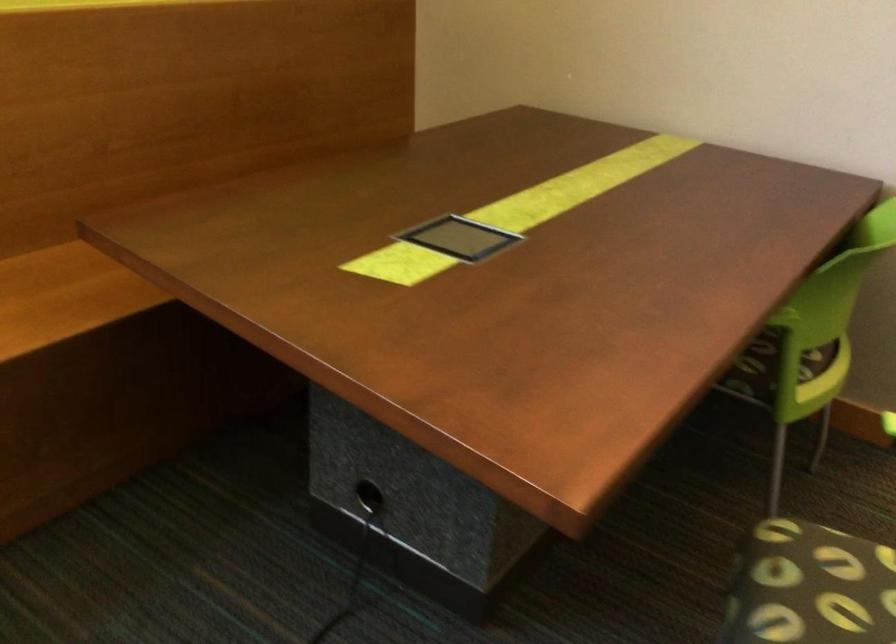
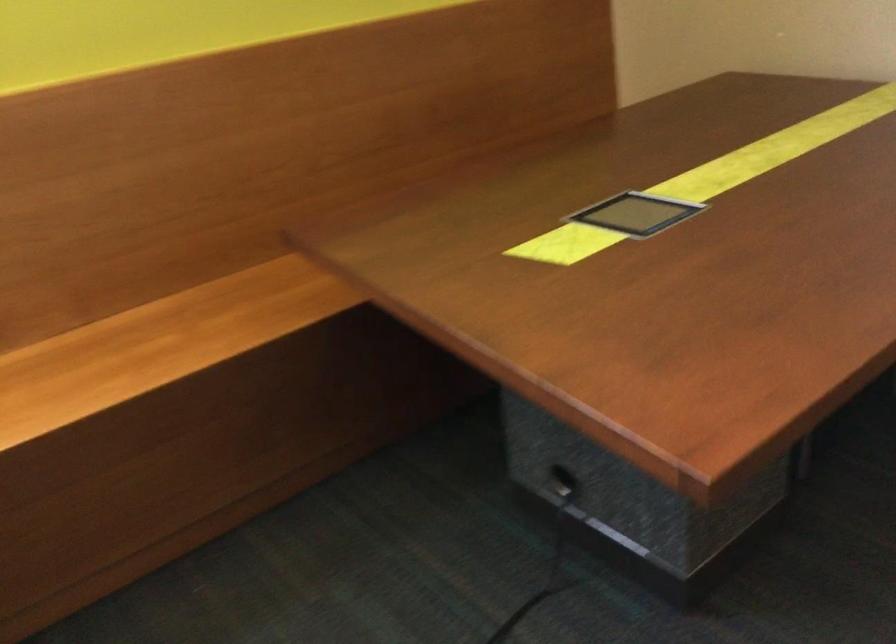
Question: The images are taken continuously from a first-person perspective. In which direction is your viewpoint rotating?

Choices:
 (A) Left
 (B) Right
 (C) Up
 (D) Down

Answer: (A)